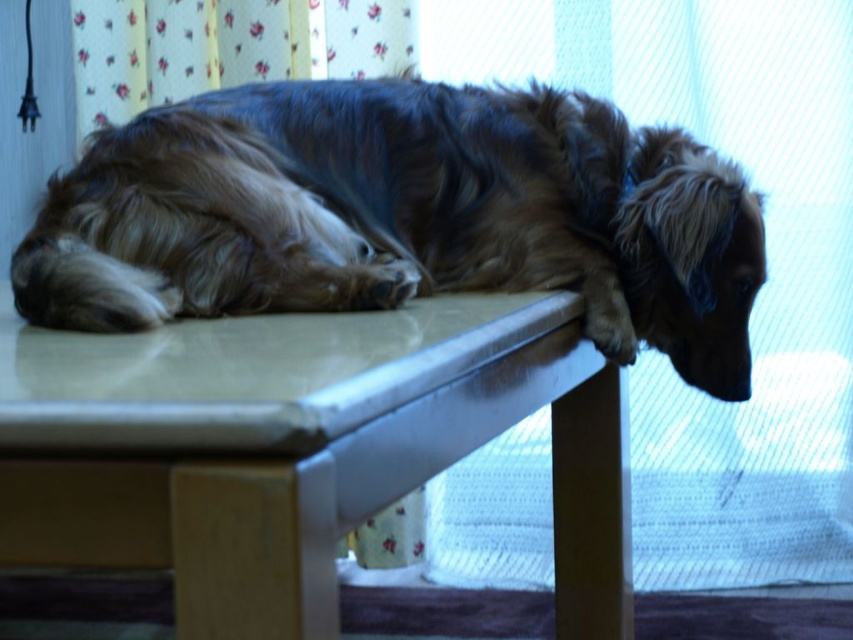
Question: Is smooth beige table at center positioned before floral fabric curtain at upper center?

Choices:
 (A) yes
 (B) no

Answer: (A)

Question: Does smooth beige table at center lie in front of floral fabric curtain at upper center?

Choices:
 (A) no
 (B) yes

Answer: (B)

Question: Is brown shaggy dog at upper center further to camera compared to smooth beige table at center?

Choices:
 (A) no
 (B) yes

Answer: (B)

Question: Estimate the real-world distances between objects in this image. Which object is farther from the brown shaggy dog at upper center?

Choices:
 (A) smooth beige table at center
 (B) floral fabric curtain at upper center

Answer: (B)

Question: Among these objects, which one is nearest to the camera?

Choices:
 (A) floral fabric curtain at upper center
 (B) brown shaggy dog at upper center

Answer: (B)

Question: Estimate the real-world distances between objects in this image. Which object is farther from the floral fabric curtain at upper center?

Choices:
 (A) smooth beige table at center
 (B) brown shaggy dog at upper center

Answer: (A)